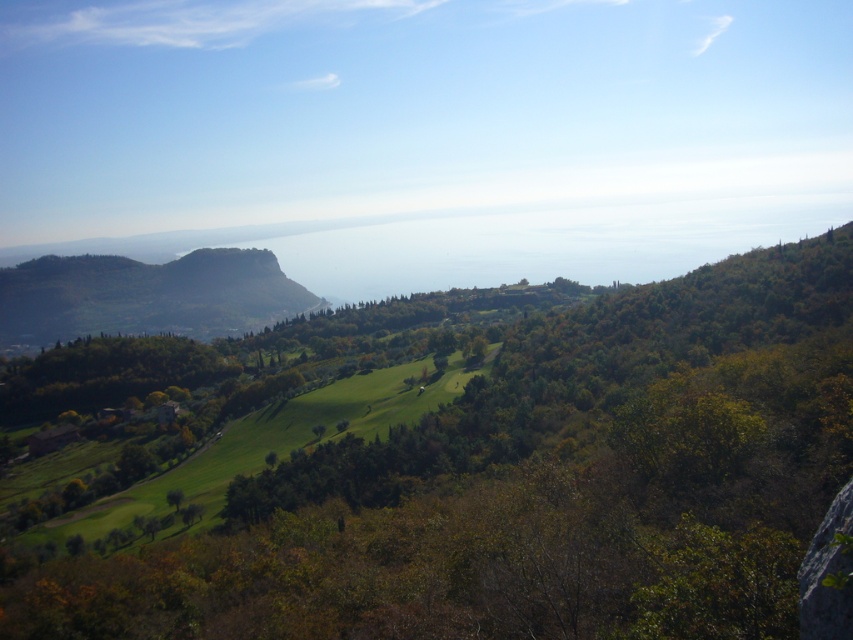
Based on the photo, who is positioned more to the right, green leafy tree at center or green forested mountain at left?

green leafy tree at center

Is green leafy tree at center above green forested mountain at left?

Actually, green leafy tree at center is below green forested mountain at left.

Which is in front, point (730, 307) or point (144, 326)?

Point (730, 307)

Locate an element on the screen. The height and width of the screenshot is (640, 853). green leafy tree at center is located at coordinates (535, 486).